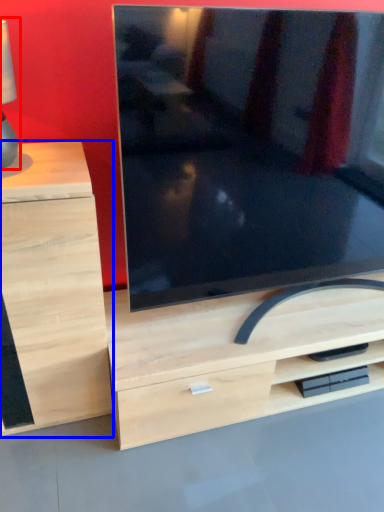
Question: Which point is closer to the camera, table lamp (highlighted by a red box) or chest of drawers (highlighted by a blue box)?

Choices:
 (A) table lamp
 (B) chest of drawers

Answer: (A)